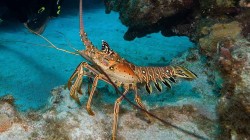
The width and height of the screenshot is (250, 140). In order to click on rostrum in this screenshot , I will do `click(81, 35)`.